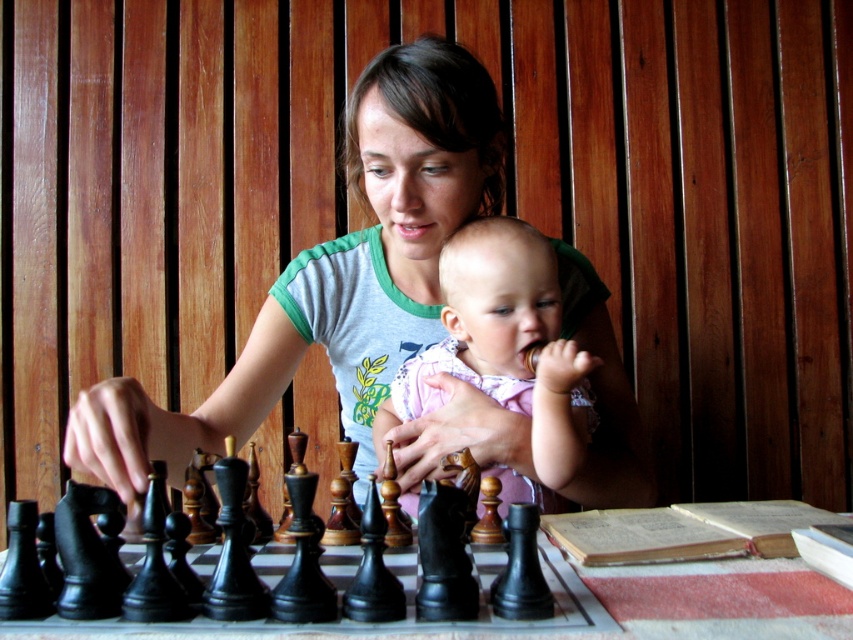
Question: In this image, where is matte gray t-shirt at center located relative to matte pink dress at center?

Choices:
 (A) below
 (B) above

Answer: (B)

Question: In this image, where is matte gray t-shirt at center located relative to matte pink dress at center?

Choices:
 (A) above
 (B) below

Answer: (A)

Question: Is matte gray t-shirt at center below matte pink dress at center?

Choices:
 (A) no
 (B) yes

Answer: (A)

Question: Among these points, which one is farthest from the camera?

Choices:
 (A) (577, 365)
 (B) (410, 481)

Answer: (B)

Question: Which object appears farthest from the camera in this image?

Choices:
 (A) matte gray t-shirt at center
 (B) matte pink dress at center

Answer: (B)